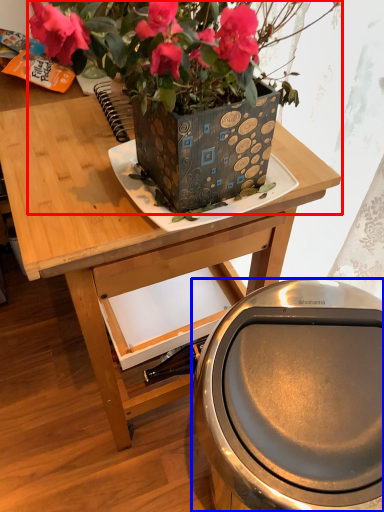
Question: Which point is further to the camera, houseplant (highlighted by a red box) or potty (highlighted by a blue box)?

Choices:
 (A) houseplant
 (B) potty

Answer: (B)